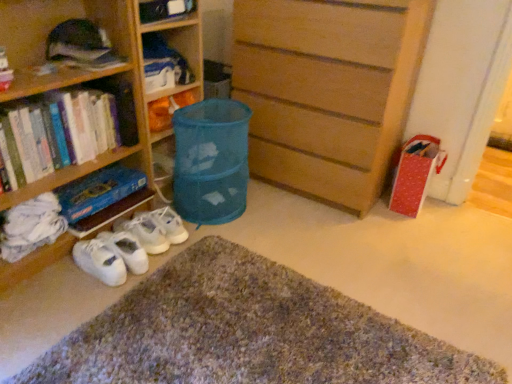
Image resolution: width=512 pixels, height=384 pixels. I want to click on white cloth at lower left, the first book when ordered from bottom to top, so click(x=31, y=226).

Identify the location of matte plastic bag at center, the 4th book ordered from the bottom. Image resolution: width=512 pixels, height=384 pixels. (169, 108).

Describe the element at coordinates (327, 90) in the screenshot. I see `wooden chest of drawers at center` at that location.

Where is `textured woolen doormat at lower center`? The width and height of the screenshot is (512, 384). textured woolen doormat at lower center is located at coordinates (247, 333).

What do you see at coordinates (247, 333) in the screenshot? I see `textured woolen doormat at lower center` at bounding box center [247, 333].

The width and height of the screenshot is (512, 384). Find the location of `white fabric sneakers at lower left`. white fabric sneakers at lower left is located at coordinates (130, 245).

Does white fabric sneakers at lower left lie in front of hardcover book at lower left, the 2th book positioned from the bottom?

No, the depth of white fabric sneakers at lower left is greater than that of hardcover book at lower left, the 2th book positioned from the bottom.

Is white fabric sneakers at lower left wider or thinner than hardcover book at lower left, marked as the third book in a top-to-bottom arrangement?

In the image, white fabric sneakers at lower left appears to be more narrow than hardcover book at lower left, marked as the third book in a top-to-bottom arrangement.

From a real-world perspective, is white fabric sneakers at lower left on top of hardcover book at lower left, the 2th book positioned from the bottom?

No.

Is blue fabric laundry basket at center completely or partially inside white cloth at lower left, which is the fourth book in top-to-bottom order?

No, blue fabric laundry basket at center is not inside white cloth at lower left, which is the fourth book in top-to-bottom order.

Does point (38, 197) lie in front of point (182, 168)?

Yes, point (38, 197) is in front of point (182, 168).

From a real-world perspective, is white cloth at lower left, which is the fourth book in top-to-bottom order, below blue fabric laundry basket at center?

Indeed, from a real-world perspective, white cloth at lower left, which is the fourth book in top-to-bottom order, is positioned beneath blue fabric laundry basket at center.

Does white cloth at lower left, which is the fourth book in top-to-bottom order, turn towards blue fabric laundry basket at center?

No, white cloth at lower left, which is the fourth book in top-to-bottom order, is not facing towards blue fabric laundry basket at center.

Considering the positions of objects hardcover book at lower left, the 2th book positioned from the bottom, and matte plastic bag at center, which ranks as the 1th book in top-to-bottom order, in the image provided, who is more to the right, hardcover book at lower left, the 2th book positioned from the bottom, or matte plastic bag at center, which ranks as the 1th book in top-to-bottom order,?

Positioned to the right is matte plastic bag at center, which ranks as the 1th book in top-to-bottom order.

From the image's perspective, is hardcover book at lower left, marked as the third book in a top-to-bottom arrangement, located above or below matte plastic bag at center, the 4th book ordered from the bottom?

Based on their image positions, hardcover book at lower left, marked as the third book in a top-to-bottom arrangement, is located beneath matte plastic bag at center, the 4th book ordered from the bottom.

Is point (2, 11) behind point (150, 102)?

No, (2, 11) is closer to viewer.

Considering the sizes of objects hardcover book at lower left, the 2th book positioned from the bottom, and matte plastic bag at center, which ranks as the 1th book in top-to-bottom order, in the image provided, who is taller, hardcover book at lower left, the 2th book positioned from the bottom, or matte plastic bag at center, which ranks as the 1th book in top-to-bottom order,?

hardcover book at lower left, the 2th book positioned from the bottom, is taller.

From the image's perspective, who appears lower, blue fabric laundry basket at center or hardcover book at lower left, marked as the third book in a top-to-bottom arrangement?

From the image's view, blue fabric laundry basket at center is below.

Is blue fabric laundry basket at center positioned with its back to hardcover book at lower left, the 2th book positioned from the bottom?

blue fabric laundry basket at center does not have its back to hardcover book at lower left, the 2th book positioned from the bottom.

Which object is closer to the camera taking this photo, blue fabric laundry basket at center or hardcover book at lower left, the 2th book positioned from the bottom?

hardcover book at lower left, the 2th book positioned from the bottom, is in front.

Is blue fabric laundry basket at center not near hardcover book at lower left, marked as the third book in a top-to-bottom arrangement?

No, blue fabric laundry basket at center is in close proximity to hardcover book at lower left, marked as the third book in a top-to-bottom arrangement.

From a real-world perspective, is wooden chest of drawers at center physically located above or below matte plastic bag at center, which ranks as the 1th book in top-to-bottom order?

In terms of real-world spatial position, wooden chest of drawers at center is above matte plastic bag at center, which ranks as the 1th book in top-to-bottom order.

From the image's perspective, is wooden chest of drawers at center above matte plastic bag at center, which ranks as the 1th book in top-to-bottom order?

Yes, from the image's perspective, wooden chest of drawers at center is above matte plastic bag at center, which ranks as the 1th book in top-to-bottom order.

Is wooden chest of drawers at center positioned far away from matte plastic bag at center, which ranks as the 1th book in top-to-bottom order?

wooden chest of drawers at center is actually quite close to matte plastic bag at center, which ranks as the 1th book in top-to-bottom order.

Can we say wooden chest of drawers at center lies outside matte plastic bag at center, which ranks as the 1th book in top-to-bottom order?

wooden chest of drawers at center is positioned outside matte plastic bag at center, which ranks as the 1th book in top-to-bottom order.

Looking at their sizes, would you say matte plastic bag at center, the 4th book ordered from the bottom, is wider or thinner than white cloth at lower left, which is the fourth book in top-to-bottom order?

Clearly, matte plastic bag at center, the 4th book ordered from the bottom, has less width compared to white cloth at lower left, which is the fourth book in top-to-bottom order.

Is point (174, 97) positioned in front of point (34, 231)?

No, (174, 97) is further to viewer.

Looking at this image, from a real-world perspective, which object rests below the other?

white cloth at lower left, which is the fourth book in top-to-bottom order.

Who is taller, white cloth at lower left, the first book when ordered from bottom to top, or wooden chest of drawers at center?

wooden chest of drawers at center.

From a real-world perspective, does white cloth at lower left, the first book when ordered from bottom to top, sit lower than wooden chest of drawers at center?

Indeed, from a real-world perspective, white cloth at lower left, the first book when ordered from bottom to top, is positioned beneath wooden chest of drawers at center.

Considering the positions of objects white cloth at lower left, the first book when ordered from bottom to top, and wooden chest of drawers at center in the image provided, who is more to the right, white cloth at lower left, the first book when ordered from bottom to top, or wooden chest of drawers at center?

wooden chest of drawers at center.

Image resolution: width=512 pixels, height=384 pixels. I want to click on footwear on the right of hardcover book at lower left, marked as the third book in a top-to-bottom arrangement, so click(x=130, y=245).

Where is `laundry basket above the white cloth at lower left, the first book when ordered from bottom to top (from a real-world perspective)`? Image resolution: width=512 pixels, height=384 pixels. laundry basket above the white cloth at lower left, the first book when ordered from bottom to top (from a real-world perspective) is located at coordinates (211, 161).

Which object lies further to the anchor point blue fabric laundry basket at center, white cloth at lower left, which is the fourth book in top-to-bottom order, or hardcover book at lower left, marked as the third book in a top-to-bottom arrangement?

white cloth at lower left, which is the fourth book in top-to-bottom order, is further to blue fabric laundry basket at center.

Considering their positions, is blue fabric laundry basket at center positioned further to white fabric sneakers at lower left than textured woolen doormat at lower center?

textured woolen doormat at lower center lies further to white fabric sneakers at lower left than the other object.

Which object lies further to the anchor point wooden chest of drawers at center, matte plastic bag at center, the 4th book ordered from the bottom, or blue fabric laundry basket at center?

matte plastic bag at center, the 4th book ordered from the bottom.

Estimate the real-world distances between objects in this image. Which object is closer to blue fabric laundry basket at center, textured woolen doormat at lower center or white fabric sneakers at lower left?

white fabric sneakers at lower left.

Estimate the real-world distances between objects in this image. Which object is further from white cloth at lower left, which is the fourth book in top-to-bottom order, wooden chest of drawers at center or blue fabric laundry basket at center?

The object further to white cloth at lower left, which is the fourth book in top-to-bottom order, is wooden chest of drawers at center.

Which object lies nearer to the anchor point white cloth at lower left, which is the fourth book in top-to-bottom order, blue fabric laundry basket at center or textured woolen doormat at lower center?

blue fabric laundry basket at center is positioned closer to the anchor white cloth at lower left, which is the fourth book in top-to-bottom order.

When comparing their distances from matte plastic bag at center, the 4th book ordered from the bottom, does blue fabric laundry basket at center or white cloth at lower left, the first book when ordered from bottom to top, seem closer?

blue fabric laundry basket at center.

Based on their spatial positions, is hardcover books at left, positioned as the third book in bottom-to-top order, or blue fabric laundry basket at center further from white fabric sneakers at lower left?

Based on the image, hardcover books at left, positioned as the third book in bottom-to-top order, appears to be further to white fabric sneakers at lower left.

I want to click on footwear between hardcover book at lower left, the 2th book positioned from the bottom, and wooden chest of drawers at center from left to right, so click(x=130, y=245).

You are a GUI agent. You are given a task and a screenshot of the screen. Output one action in this format:
    pyautogui.click(x=<x>, y=<y>)
    Task: Click on the footwear between white cloth at lower left, the first book when ordered from bottom to top, and blue fabric laundry basket at center
    The image size is (512, 384).
    Given the screenshot: What is the action you would take?
    pyautogui.click(x=130, y=245)

Where is `doormat between white cloth at lower left, which is the fourth book in top-to-bottom order, and wooden chest of drawers at center from left to right`? doormat between white cloth at lower left, which is the fourth book in top-to-bottom order, and wooden chest of drawers at center from left to right is located at coordinates tap(247, 333).

Locate an element on the screen. Image resolution: width=512 pixels, height=384 pixels. footwear between hardcover book at lower left, marked as the third book in a top-to-bottom arrangement, and textured woolen doormat at lower center, in the horizontal direction is located at coordinates (130, 245).